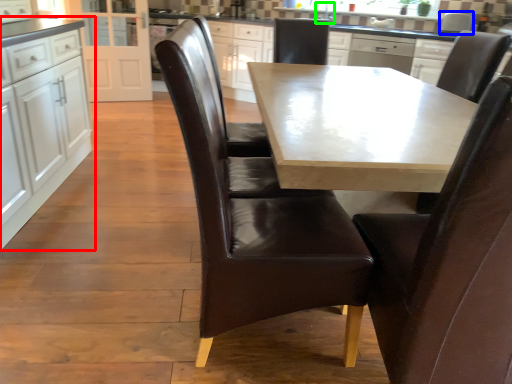
Question: Considering the real-world distances, which object is farthest from cabinetry (highlighted by a red box)? appliance (highlighted by a blue box) or sink (highlighted by a green box)?

Choices:
 (A) appliance
 (B) sink

Answer: (A)